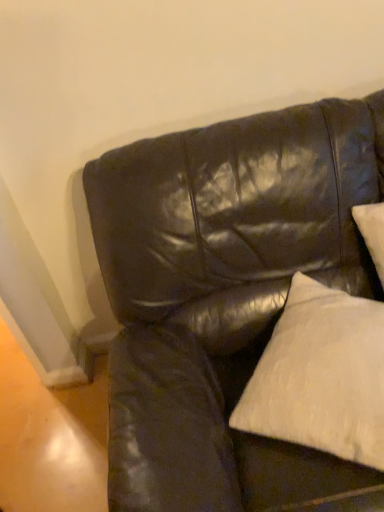
Describe the element at coordinates (321, 376) in the screenshot. The width and height of the screenshot is (384, 512). I see `white cotton pillow at upper right` at that location.

This screenshot has width=384, height=512. I want to click on white cotton pillow at upper right, so click(x=321, y=376).

This screenshot has width=384, height=512. Find the location of `glossy leather couch at upper right`. glossy leather couch at upper right is located at coordinates (225, 296).

The width and height of the screenshot is (384, 512). Describe the element at coordinates (225, 296) in the screenshot. I see `glossy leather couch at upper right` at that location.

This screenshot has height=512, width=384. I want to click on white cotton pillow at upper right, so click(x=321, y=376).

Is white cotton pillow at upper right at the right side of glossy leather couch at upper right?

Correct, you'll find white cotton pillow at upper right to the right of glossy leather couch at upper right.

Does white cotton pillow at upper right come in front of glossy leather couch at upper right?

That is False.

Considering the points (289, 400) and (173, 284), which point is behind, point (289, 400) or point (173, 284)?

The point (173, 284) is more distant.

From the image's perspective, which one is positioned lower, white cotton pillow at upper right or glossy leather couch at upper right?

From the image's view, glossy leather couch at upper right is below.

Looking at this image, from a real-world perspective, is white cotton pillow at upper right positioned above or below glossy leather couch at upper right?

white cotton pillow at upper right is above glossy leather couch at upper right.

Which of these two, white cotton pillow at upper right or glossy leather couch at upper right, is wider?

Wider between the two is glossy leather couch at upper right.

From their relative heights in the image, would you say white cotton pillow at upper right is taller or shorter than glossy leather couch at upper right?

In the image, white cotton pillow at upper right appears to be shorter than glossy leather couch at upper right.

Does white cotton pillow at upper right have a larger size compared to glossy leather couch at upper right?

No, white cotton pillow at upper right is not bigger than glossy leather couch at upper right.

Is white cotton pillow at upper right completely or partially outside of glossy leather couch at upper right?

No, white cotton pillow at upper right is inside or overlapping with glossy leather couch at upper right.

Is white cotton pillow at upper right far from glossy leather couch at upper right?

No, white cotton pillow at upper right is not far from glossy leather couch at upper right.

Is white cotton pillow at upper right facing away from glossy leather couch at upper right?

Yes, glossy leather couch at upper right is at the back of white cotton pillow at upper right.

Can you tell me how much white cotton pillow at upper right and glossy leather couch at upper right differ in facing direction?

34.2 degrees.

Where is `studio couch that appears below the white cotton pillow at upper right (from the image's perspective)`? The width and height of the screenshot is (384, 512). studio couch that appears below the white cotton pillow at upper right (from the image's perspective) is located at coordinates (225, 296).

From the picture: Does glossy leather couch at upper right appear on the right side of white cotton pillow at upper right?

No.

From the picture: Is the depth of glossy leather couch at upper right greater than that of white cotton pillow at upper right?

No, glossy leather couch at upper right is in front of white cotton pillow at upper right.

Is point (305, 231) positioned behind point (338, 341)?

Yes, point (305, 231) is behind point (338, 341).

From the image's perspective, is glossy leather couch at upper right under white cotton pillow at upper right?

Yes, from the image's perspective, glossy leather couch at upper right is beneath white cotton pillow at upper right.

From a real-world perspective, relative to white cotton pillow at upper right, is glossy leather couch at upper right vertically above or below?

In terms of real-world spatial position, glossy leather couch at upper right is below white cotton pillow at upper right.

Considering the sizes of objects glossy leather couch at upper right and white cotton pillow at upper right in the image provided, who is wider, glossy leather couch at upper right or white cotton pillow at upper right?

With larger width is glossy leather couch at upper right.

Is glossy leather couch at upper right taller than white cotton pillow at upper right?

Correct, glossy leather couch at upper right is much taller as white cotton pillow at upper right.

Does glossy leather couch at upper right have a smaller size compared to white cotton pillow at upper right?

No.

Is white cotton pillow at upper right surrounded by glossy leather couch at upper right?

Yes, glossy leather couch at upper right is surrounding white cotton pillow at upper right.

Is glossy leather couch at upper right directly adjacent to white cotton pillow at upper right?

glossy leather couch at upper right and white cotton pillow at upper right are not in contact.

Could you tell me if glossy leather couch at upper right is facing white cotton pillow at upper right?

Yes, glossy leather couch at upper right is turned towards white cotton pillow at upper right.

This screenshot has width=384, height=512. Find the location of `pillow behind the glossy leather couch at upper right`. pillow behind the glossy leather couch at upper right is located at coordinates (321, 376).

Where is `studio couch that appears on the left of white cotton pillow at upper right`? The width and height of the screenshot is (384, 512). studio couch that appears on the left of white cotton pillow at upper right is located at coordinates (225, 296).

Where is `pillow behind the glossy leather couch at upper right`? The image size is (384, 512). pillow behind the glossy leather couch at upper right is located at coordinates (321, 376).